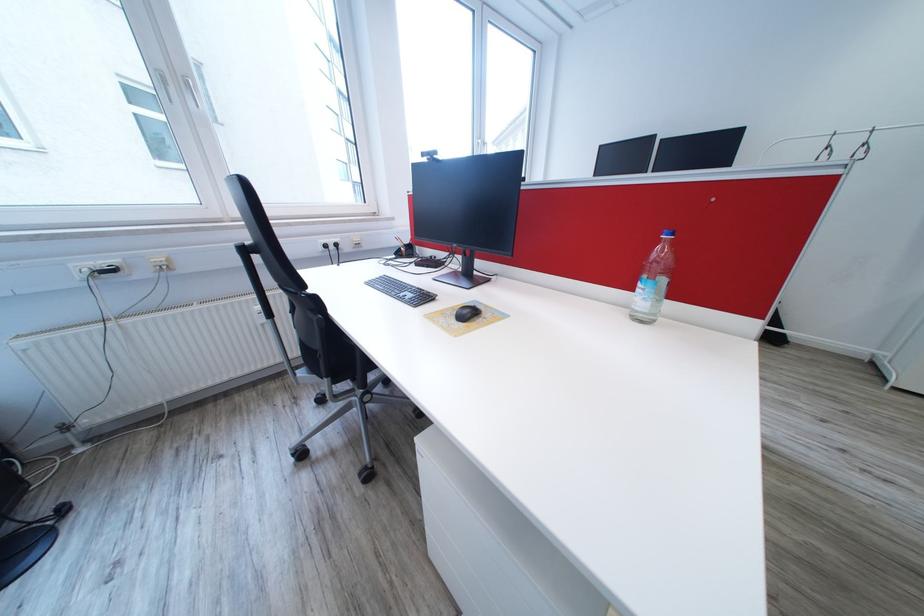
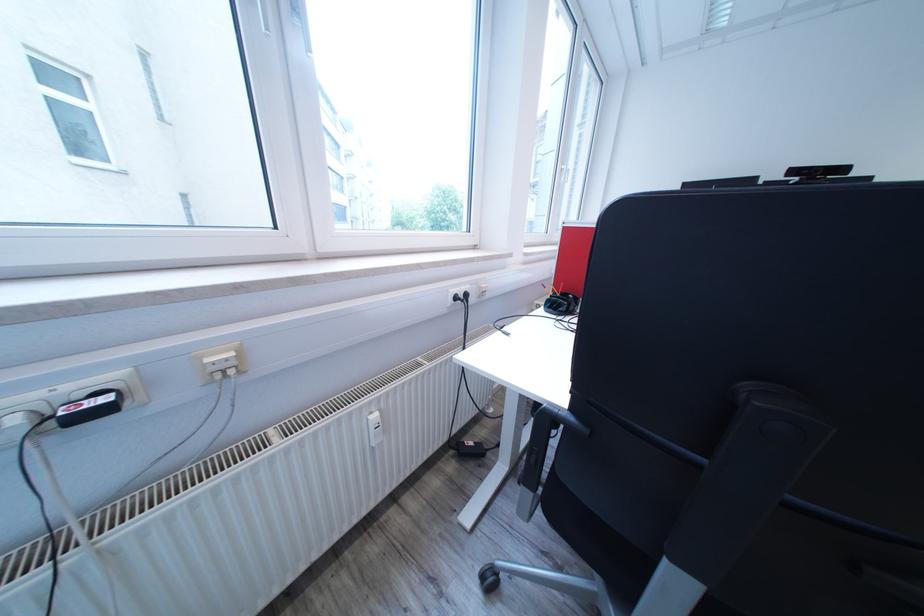
Which direction would the cameraman need to move to produce the second image?

The movement direction of the cameraman is left, forward.